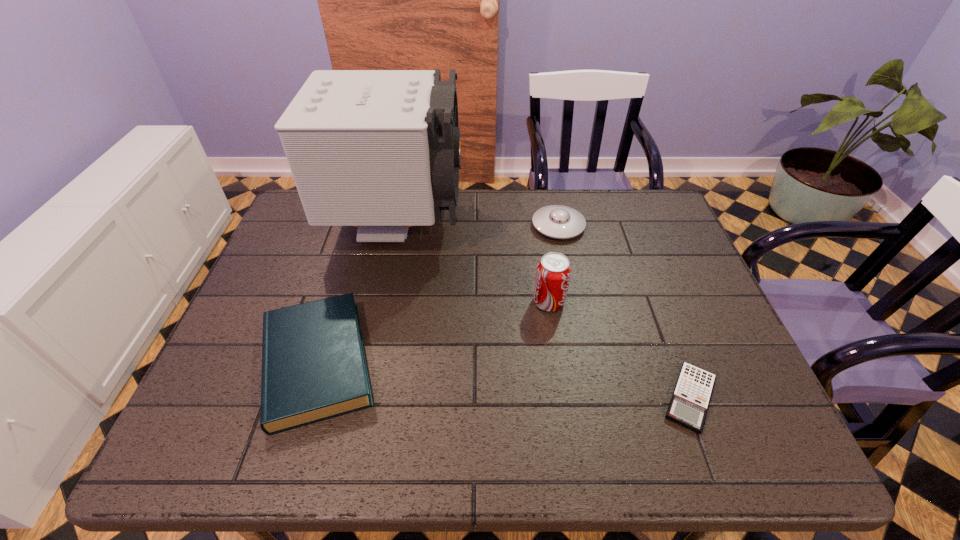
This screenshot has height=540, width=960. In order to click on vacant area that lies between the second tallest object and the book in this screenshot , I will do `click(433, 332)`.

What are the coordinates of `free area in between the rightmost object and the book` in the screenshot? It's located at (504, 380).

Find the location of `free area in between the tallest object and the saucer`. free area in between the tallest object and the saucer is located at coordinates 478,225.

Where is `vacant point located between the book and the shortest object`? vacant point located between the book and the shortest object is located at coordinates (504, 380).

Where is `free space between the saucer and the calculator`? free space between the saucer and the calculator is located at coordinates (624, 312).

This screenshot has height=540, width=960. Identify the location of free spot between the book and the calculator. (504, 380).

Image resolution: width=960 pixels, height=540 pixels. Identify the location of free space between the book and the rightmost object. pos(504,380).

The image size is (960, 540). I want to click on object that is the fourth closest to the book, so (688, 407).

The height and width of the screenshot is (540, 960). I want to click on object that stands as the third closest to the fourth shortest object, so click(x=688, y=407).

The height and width of the screenshot is (540, 960). In order to click on vacant space that satisfies the following two spatial constraints: 1. on the front side of the fan; 2. on the left side of the saucer in this screenshot , I will do `click(397, 226)`.